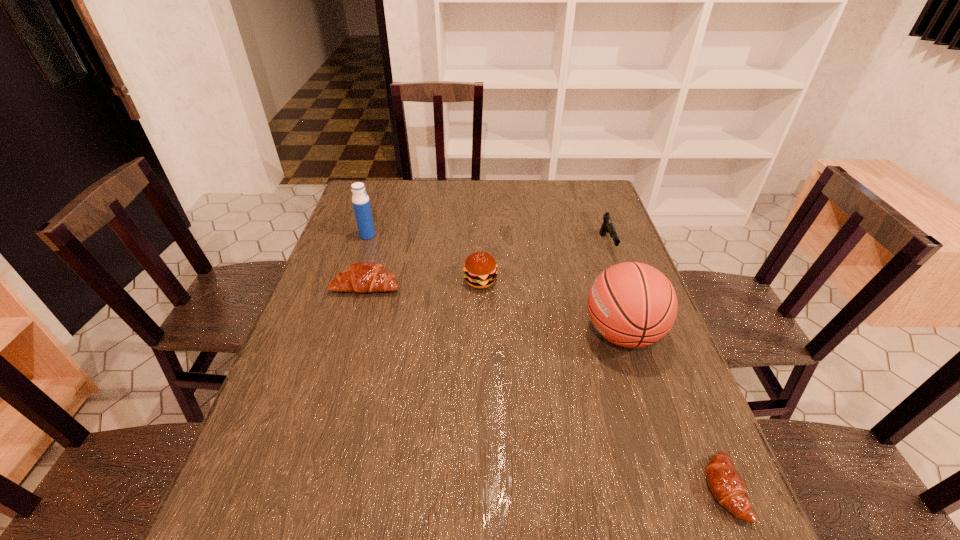
In order to click on vacant area between the gun and the water bottle in this screenshot , I will do `click(487, 241)`.

The height and width of the screenshot is (540, 960). I want to click on empty space that is in between the hamburger and the gun, so click(543, 264).

Where is `vacant point located between the hamburger and the second nearest object`? This screenshot has width=960, height=540. vacant point located between the hamburger and the second nearest object is located at coordinates (552, 307).

This screenshot has width=960, height=540. What are the coordinates of `free space between the farther crescent roll and the hamburger` in the screenshot? It's located at [x=423, y=283].

In order to click on free spot between the second nearest object and the water bottle in this screenshot , I will do `click(495, 284)`.

This screenshot has height=540, width=960. What are the coordinates of `free space between the water bottle and the third object from left to right` in the screenshot? It's located at (424, 258).

Locate an element on the screen. This screenshot has width=960, height=540. free space between the right crescent roll and the second nearest object is located at coordinates (673, 411).

I want to click on vacant space that's between the shortest object and the gun, so click(665, 367).

Locate an element on the screen. object that stands as the third closest to the gun is located at coordinates (727, 486).

Identify the location of object that is the fifth closest to the second nearest object. This screenshot has width=960, height=540. (360, 200).